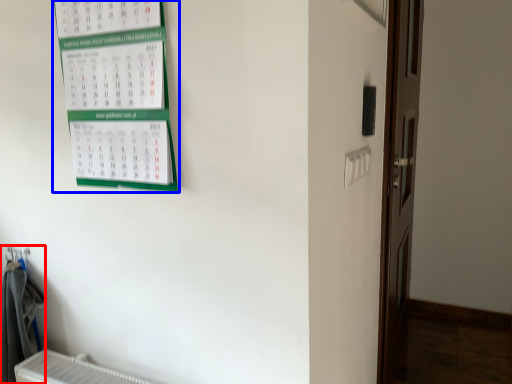
Question: Which object is closer to the camera taking this photo, laundry (highlighted by a red box) or bulletin board (highlighted by a blue box)?

Choices:
 (A) laundry
 (B) bulletin board

Answer: (B)